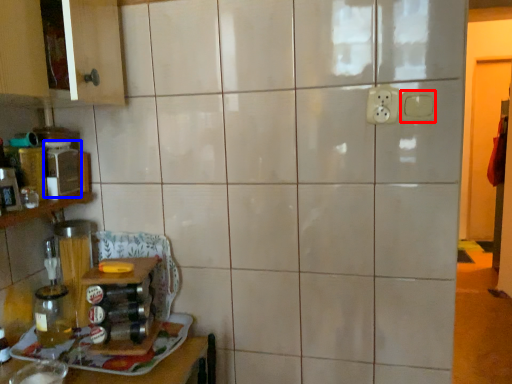
Question: Which object appears farthest to the camera in this image, electric outlet (highlighted by a red box) or appliance (highlighted by a blue box)?

Choices:
 (A) electric outlet
 (B) appliance

Answer: (B)